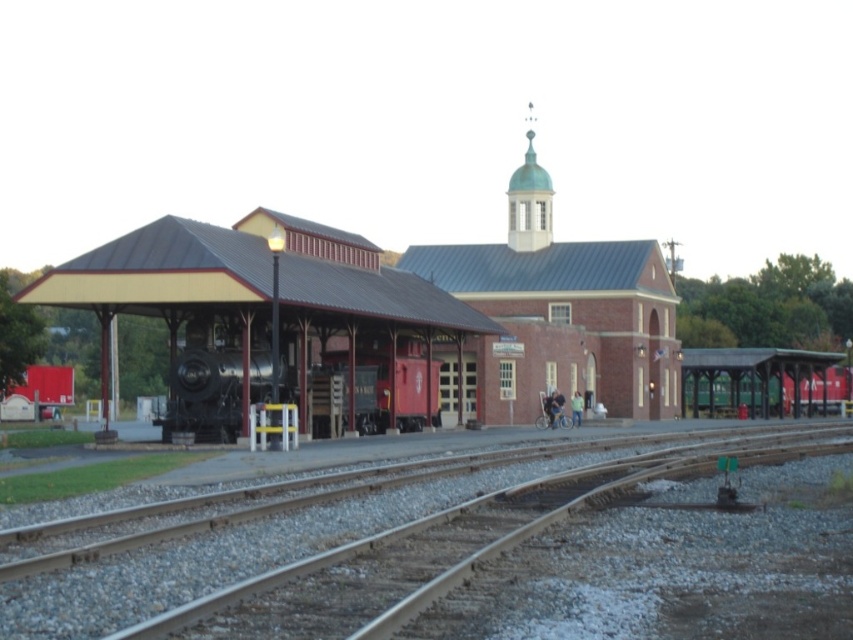
Question: Which point is closer to the camera?

Choices:
 (A) coord(409,337)
 (B) coord(509,488)

Answer: (B)

Question: From the image, what is the correct spatial relationship of smooth steel tracks at center in relation to polished steel train at center?

Choices:
 (A) above
 (B) below

Answer: (B)

Question: Does smooth steel tracks at center appear under polished steel train at center?

Choices:
 (A) yes
 (B) no

Answer: (A)

Question: Which point is closer to the camera?

Choices:
 (A) (86, 531)
 (B) (357, 364)

Answer: (A)

Question: In this image, where is smooth steel tracks at center located relative to polished steel train at center?

Choices:
 (A) below
 (B) above

Answer: (A)